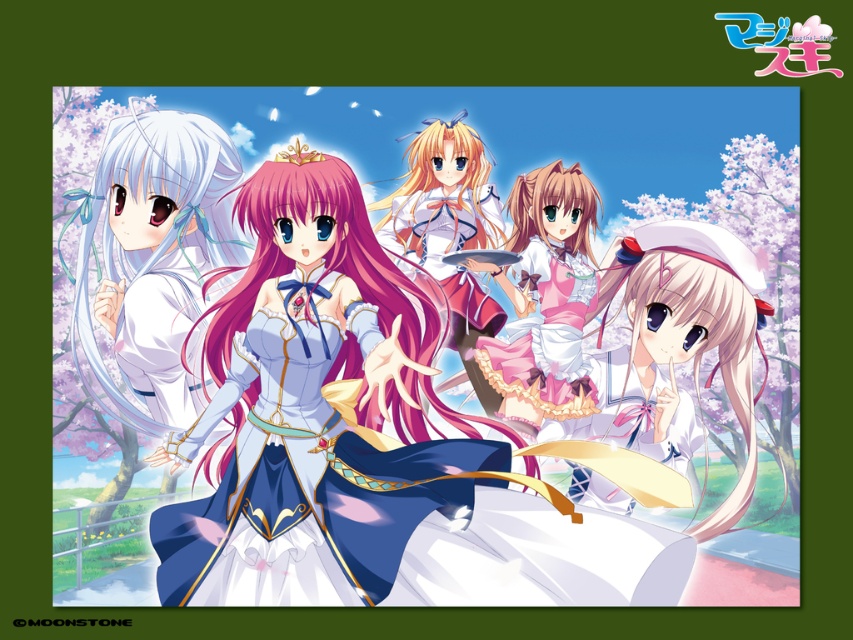
You are standing at the origin point in the image. Which of the two points, point (267, 403) or point (448, 132), is closer to you?

Point (267, 403) is closer to you because it is in front of point (448, 132).

Where is the satin white dress at center located in the image?

The satin white dress at center is located at point 0.642 on the x axis and 0.363 on the y axis.